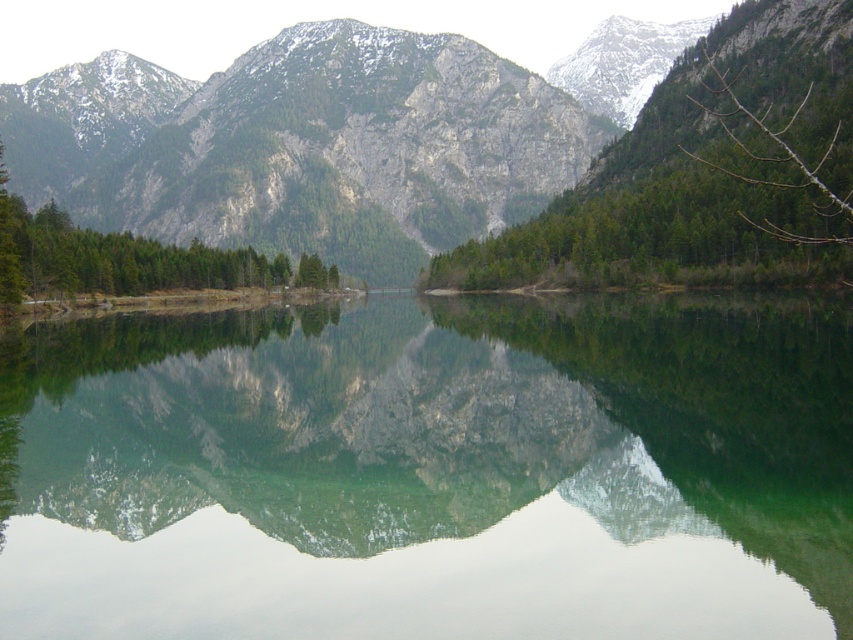
You are planning to set up a small boat in the green reflective water at center. The boat requires a minimum of 60 meters of distance from the green matte tree at center for safety. Based on the scene, is the current distance sufficient?

The green reflective water at center and green matte tree at center are 58.03 meters apart, which is less than the required 60 meters. Therefore, the current distance is insufficient for safety.

You are standing on the lakeside path and see the green reflective water at center and the green matte tree at left. Which object is positioned to the right of the other?

The green reflective water at center is to the right of the green matte tree at left.

You are standing at the edge of the lake and see the green matte tree at center and the green matte tree at left. Which tree is positioned to the right side of the other?

The green matte tree at center is positioned to the right of the green matte tree at left.